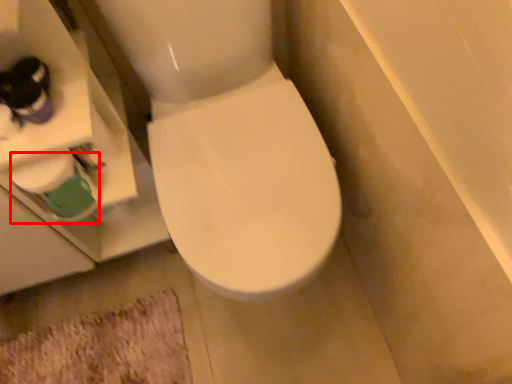
Question: From the image, what is the correct spatial relationship of toilet paper (annotated by the red box) in relation to bath mat?

Choices:
 (A) left
 (B) right

Answer: (B)